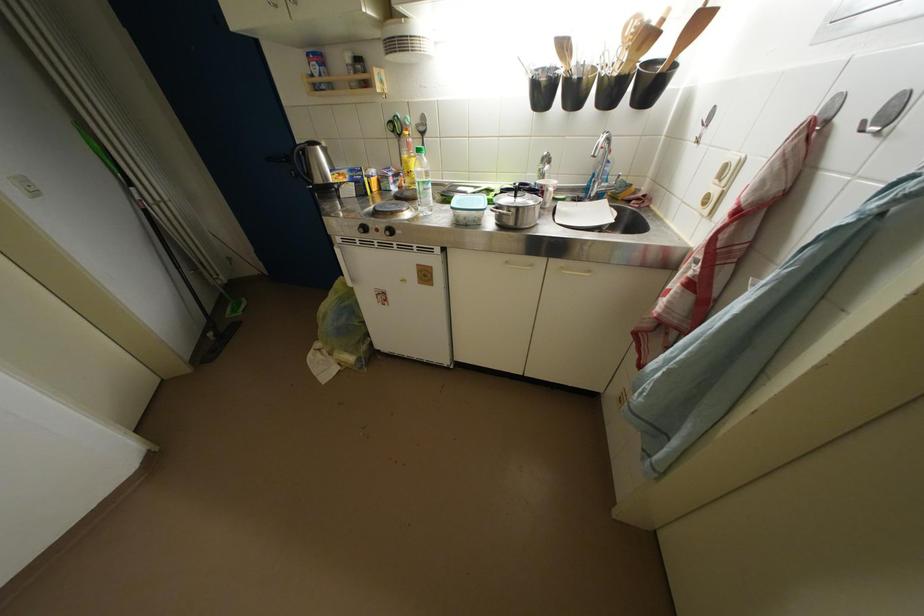
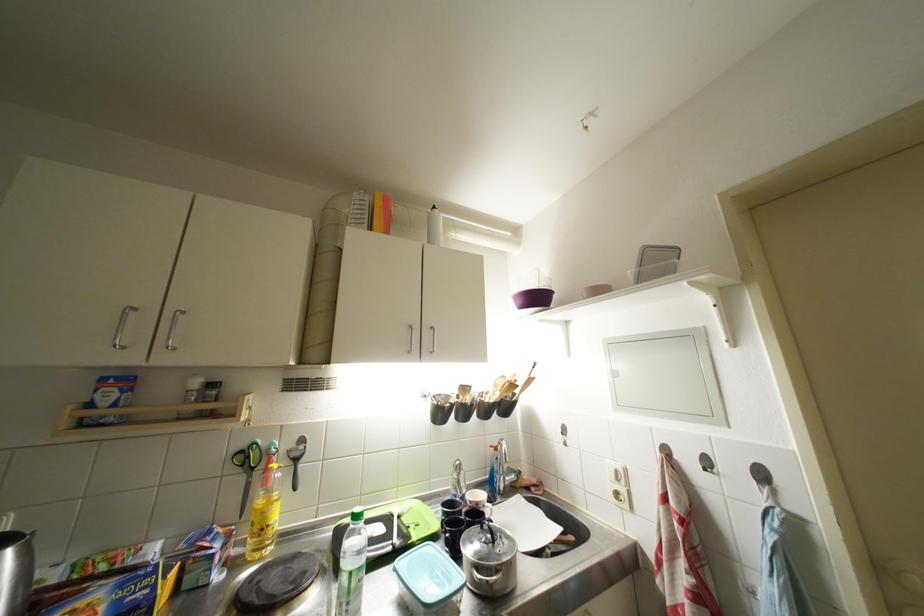
In the second image, find the point that corresponds to point 428,193 in the first image.

(359, 589)